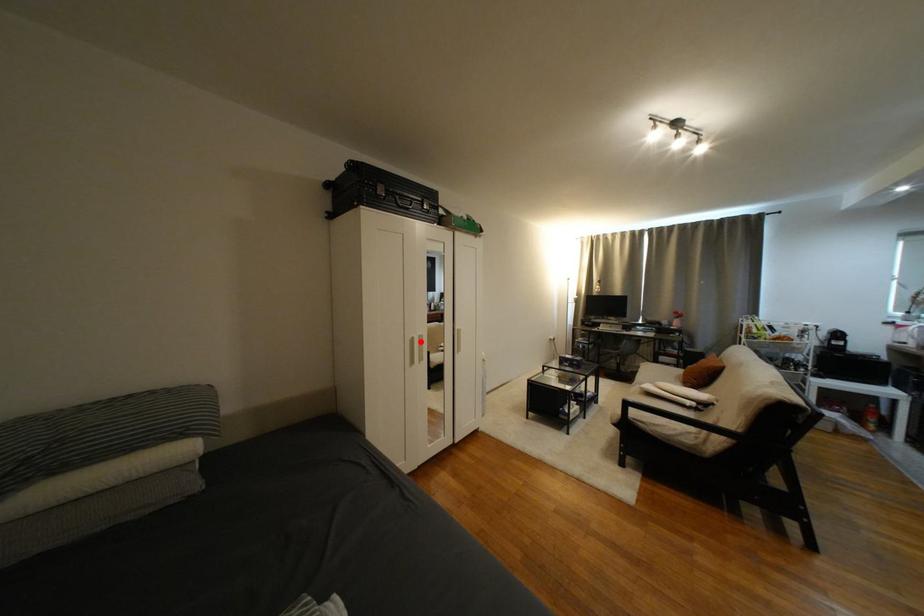
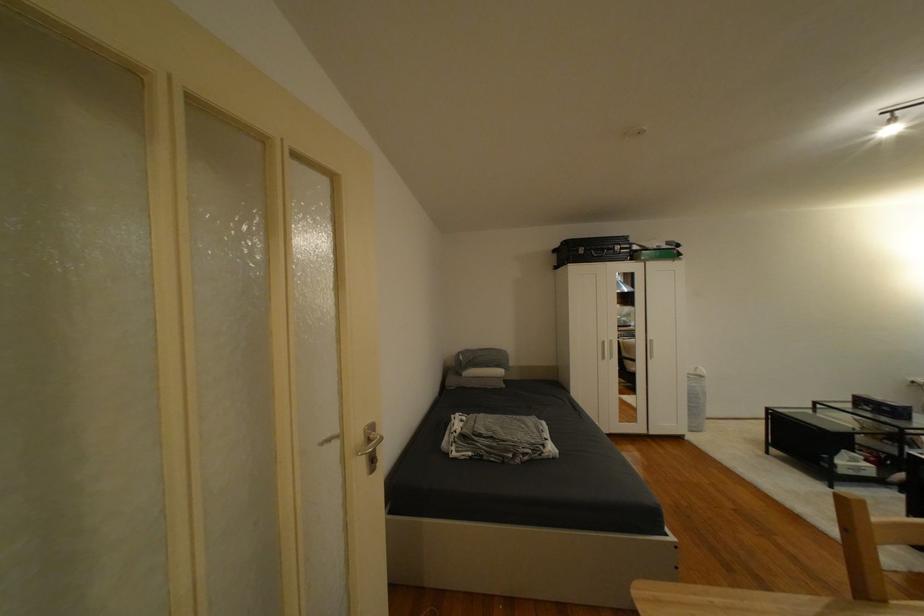
Where in the second image is the point corresponding to the highlighted location from the first image?

(612, 344)